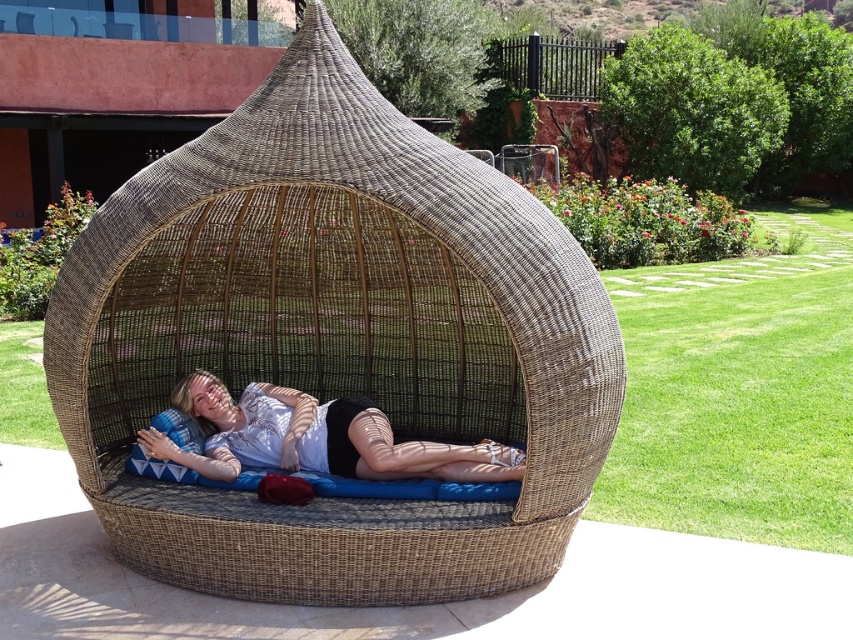
You are a delivery person who needs to place a small package between the woven rattan basket at center and the matte white shirt at center. Can you fit the package in the space between them?

The woven rattan basket at center and the matte white shirt at center are 24.73 inches apart from each other. The package can be placed between them as the distance is sufficient.

Consider the image. You are standing in the garden and want to place a small potted plant between the two points labeled point (363, 288) and point (300, 413). Which point should the plant be closer to in order to be closer to the camera?

The plant should be closer to point (363, 288) because it is further to the camera than point (300, 413).